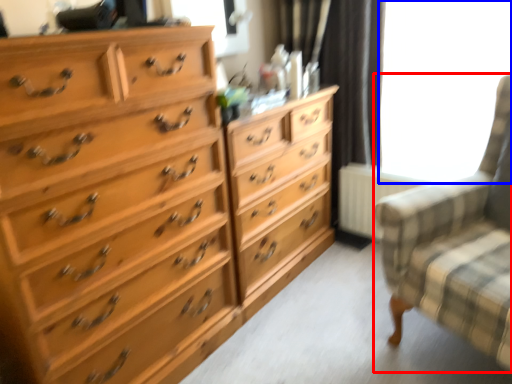
Question: Which object is further to the camera taking this photo, rocking chair (highlighted by a red box) or window screen (highlighted by a blue box)?

Choices:
 (A) rocking chair
 (B) window screen

Answer: (B)